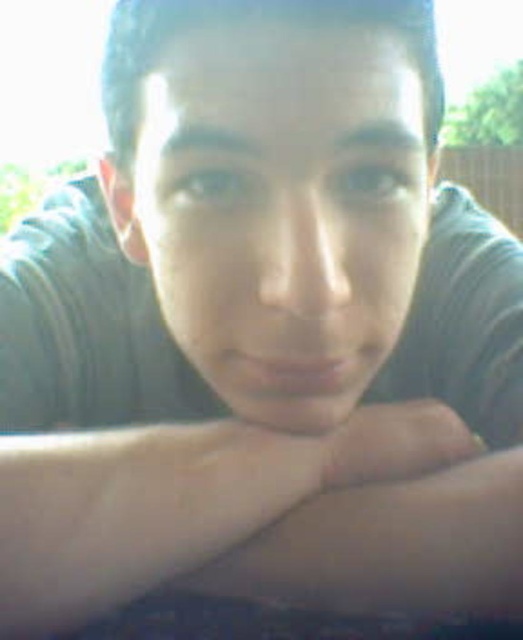
You are a photographer adjusting lighting for a portrait. You notice the skinny white arm at center and smooth skin at center in your frame. Which object would cast a larger shadow if the light source is directly above them?

The skinny white arm at center is larger in size than smooth skin at center, so it would cast a larger shadow.

Looking at the image, there are two features at the center of the scene. The first is a skinny white arm at center, and the second is smooth skin at center. Which of these two features is positioned more to the left?

The skinny white arm at center is positioned to the left of smooth skin at center.

You are a photographer adjusting lighting equipment. You notice the skinny white arm at center and the smooth skin at center in the image. Given that the two are 2.20 inches apart, will the glare at the top left corner affect the lighting on both areas equally?

The skinny white arm at center and smooth skin at center are 2.20 inches apart. The glare at the top left corner may not affect both areas equally since their proximity to the glare source differs based on their spatial separation.